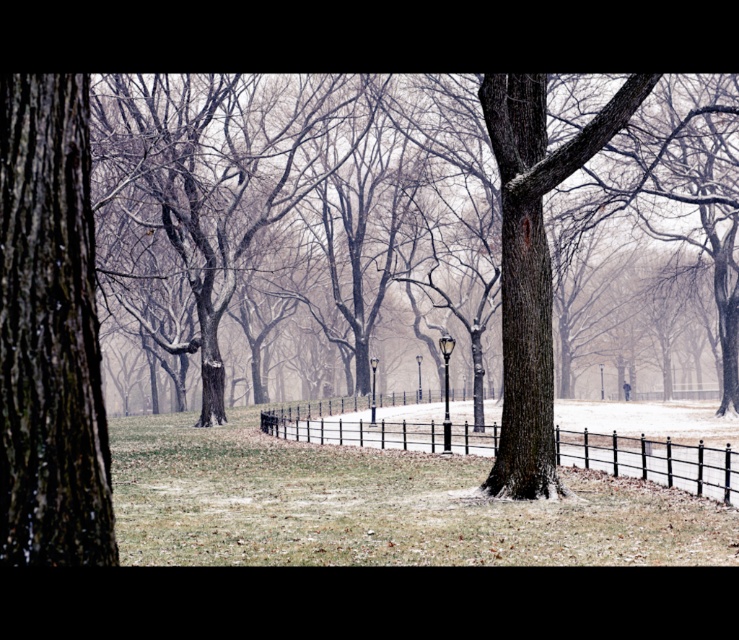
Question: Considering the relative positions of smooth bark tree at center and black metal fence at center in the image provided, where is smooth bark tree at center located with respect to black metal fence at center?

Choices:
 (A) left
 (B) right

Answer: (B)

Question: Which object appears farthest from the camera in this image?

Choices:
 (A) black metal fence at center
 (B) smooth bark tree at center

Answer: (A)

Question: Which is nearer to the smooth bark tree at left?

Choices:
 (A) smooth bark tree at center
 (B) black metal fence at center

Answer: (B)

Question: Can you confirm if smooth bark tree at left is thinner than smooth bark tree at center?

Choices:
 (A) no
 (B) yes

Answer: (B)

Question: Can you confirm if smooth bark tree at center is positioned to the right of black metal fence at center?

Choices:
 (A) yes
 (B) no

Answer: (A)

Question: Which object appears farthest from the camera in this image?

Choices:
 (A) smooth bark tree at left
 (B) black metal fence at center
 (C) smooth bark tree at center

Answer: (B)